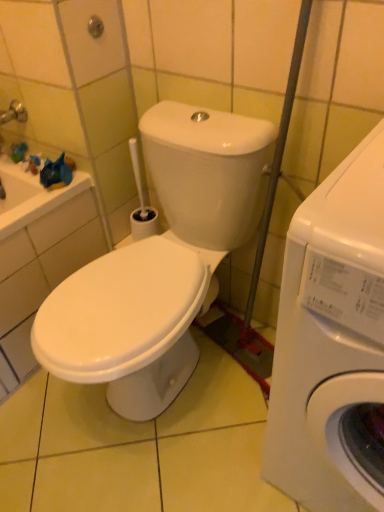
Question: Do you think white glossy washing machine at right, arranged as the second washing machine when viewed from the right, is within green rubber shower at upper left, or outside of it?

Choices:
 (A) outside
 (B) inside

Answer: (A)

Question: Considering the positions of white glossy washing machine at right, positioned as the 1th washing machine in left-to-right order, and green rubber shower at upper left in the image, is white glossy washing machine at right, positioned as the 1th washing machine in left-to-right order, wider or thinner than green rubber shower at upper left?

Choices:
 (A) thin
 (B) wide

Answer: (B)

Question: Which object is positioned farthest from the green rubber shower at upper left?

Choices:
 (A) white glossy washing machine at right, which ranks as the second washing machine in left-to-right order
 (B) white glossy washing machine at right, positioned as the 1th washing machine in left-to-right order

Answer: (A)

Question: Considering the real-world distances, which object is closest to the white glossy washing machine at right, which ranks as the second washing machine in left-to-right order?

Choices:
 (A) white glossy washing machine at right, positioned as the 1th washing machine in left-to-right order
 (B) green rubber shower at upper left

Answer: (A)